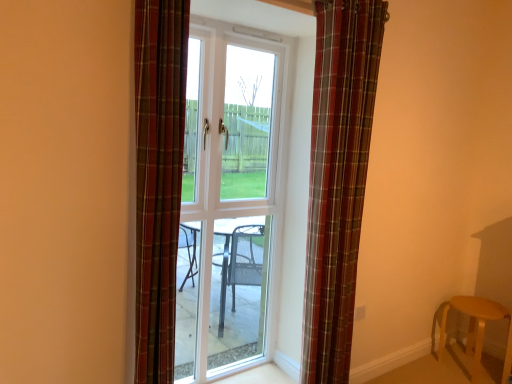
Question: Considering the relative positions of white glass door at center and plaid fabric curtain at center, the 1th curtain from the left, in the image provided, is white glass door at center behind plaid fabric curtain at center, the 1th curtain from the left,?

Choices:
 (A) yes
 (B) no

Answer: (A)

Question: From the image's perspective, is white glass door at center under plaid fabric curtain at center, the 2th curtain when ordered from right to left?

Choices:
 (A) no
 (B) yes

Answer: (B)

Question: From the image's perspective, would you say white glass door at center is positioned over plaid fabric curtain at center, marked as the 2th curtain in a back-to-front arrangement?

Choices:
 (A) no
 (B) yes

Answer: (A)

Question: Is white glass door at center smaller than plaid fabric curtain at center, which appears as the 1th curtain when viewed from the front?

Choices:
 (A) no
 (B) yes

Answer: (A)

Question: Is white glass door at center touching plaid fabric curtain at center, the 1th curtain from the left?

Choices:
 (A) yes
 (B) no

Answer: (B)

Question: Is plaid fabric curtain at center, positioned as the 1th curtain in back-to-front order, taller or shorter than white glass door at center?

Choices:
 (A) short
 (B) tall

Answer: (B)

Question: Considering the positions of plaid fabric curtain at center, positioned as the second curtain in left-to-right order, and white glass door at center in the image, is plaid fabric curtain at center, positioned as the second curtain in left-to-right order, wider or thinner than white glass door at center?

Choices:
 (A) thin
 (B) wide

Answer: (B)

Question: From a real-world perspective, is plaid fabric curtain at center, positioned as the second curtain in left-to-right order, positioned above or below white glass door at center?

Choices:
 (A) below
 (B) above

Answer: (B)

Question: Is plaid fabric curtain at center, positioned as the second curtain in left-to-right order, in front of or behind white glass door at center in the image?

Choices:
 (A) front
 (B) behind

Answer: (A)

Question: From a real-world perspective, is wooden stool at lower right above or below plaid fabric curtain at center, the 1th curtain from the left?

Choices:
 (A) below
 (B) above

Answer: (A)

Question: Considering the positions of point (471, 375) and point (143, 125), is point (471, 375) closer or farther from the camera than point (143, 125)?

Choices:
 (A) closer
 (B) farther

Answer: (B)

Question: Relative to plaid fabric curtain at center, marked as the 2th curtain in a back-to-front arrangement, is wooden stool at lower right in front or behind?

Choices:
 (A) front
 (B) behind

Answer: (B)

Question: Would you say wooden stool at lower right is to the left or to the right of plaid fabric curtain at center, the 2th curtain when ordered from right to left, in the picture?

Choices:
 (A) left
 (B) right

Answer: (B)

Question: Is point (224, 52) closer or farther from the camera than point (482, 299)?

Choices:
 (A) farther
 (B) closer

Answer: (B)

Question: From the image's perspective, is white glass door at center above or below wooden stool at lower right?

Choices:
 (A) below
 (B) above

Answer: (B)